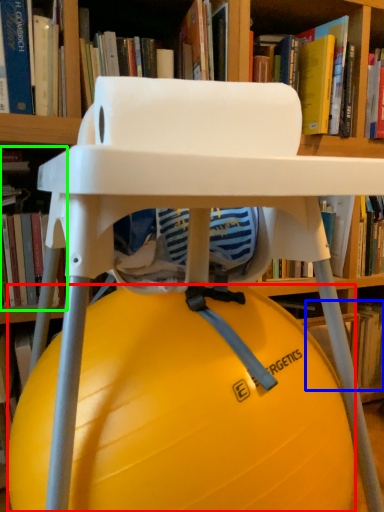
Question: Based on their relative distances, which object is nearer to ball (highlighted by a red box)? Choose from book (highlighted by a blue box) and book (highlighted by a green box).

Choices:
 (A) book
 (B) book

Answer: (B)